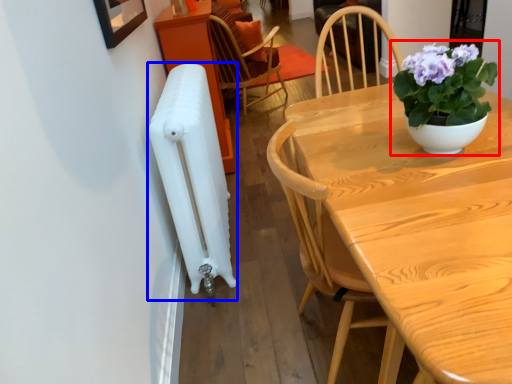
Question: Which object appears farthest to the camera in this image, houseplant (highlighted by a red box) or radiator (highlighted by a blue box)?

Choices:
 (A) houseplant
 (B) radiator

Answer: (B)